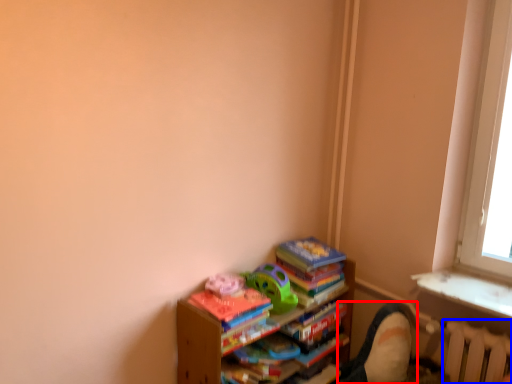
Question: Which object appears farthest to the camera in this image, swivel chair (highlighted by a red box) or radiator (highlighted by a blue box)?

Choices:
 (A) swivel chair
 (B) radiator

Answer: (A)